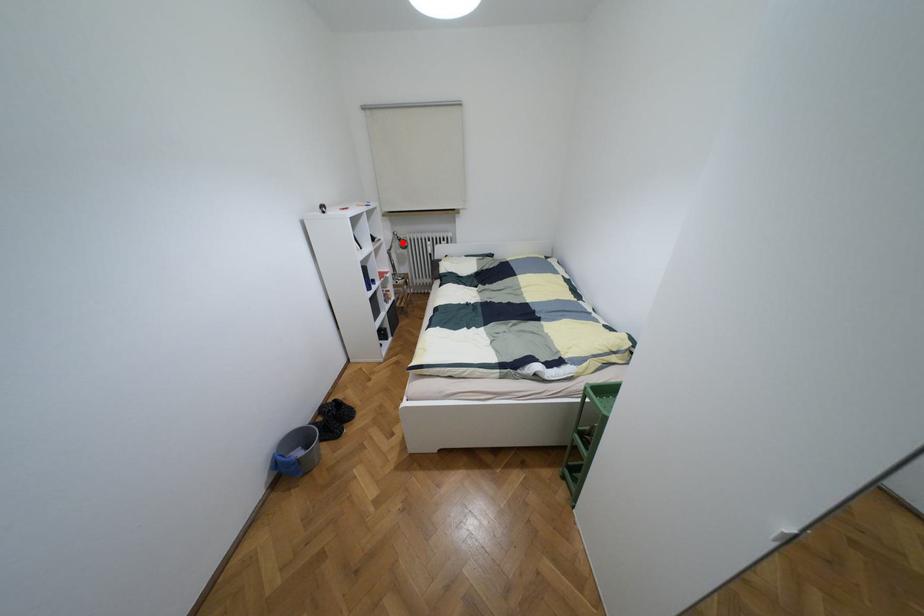
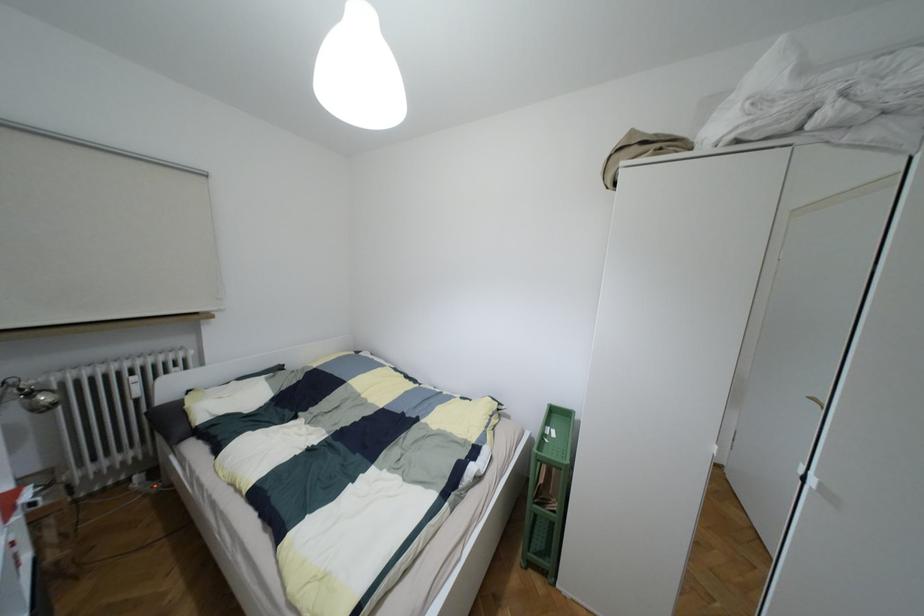
In the second image, find the point that corresponds to the highlighted location in the first image.

(43, 397)